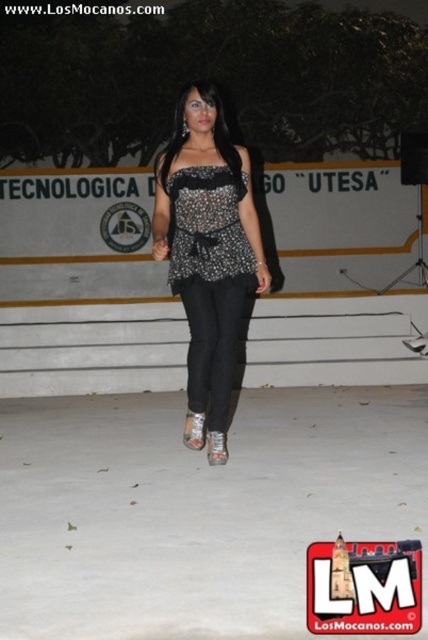
You are a photographer at the event and want to capture the woman in a way that both the sparkly black top at center and the sparkly sequined dress at center are clearly visible. Since they are both at the center, how should you adjust your camera angle to ensure both are in focus?

The sparkly black top at center is positioned under the sparkly sequined dress at center. To capture both clearly, adjust the camera angle to look slightly upward to include both the top and the dress in the frame.

You are a photographer positioned at the origin point in the image. You want to capture a photo that includes both the point at coordinates point (249, 291) and point (172, 214). Which point should you focus on first to ensure both are in the frame?

You should focus on point (249, 291) first because it is in front of point (172, 214), so adjusting the focus from the closer point to the farther one will help ensure both are in the frame.

You are a photographer at the event. You need to capture a clear photo of both the sparkly black top at center and the sparkly sequined dress at center. Which one will appear larger in your photo?

The sparkly black top at center will appear larger in the photo because it is closer to the viewer than the sparkly sequined dress at center.